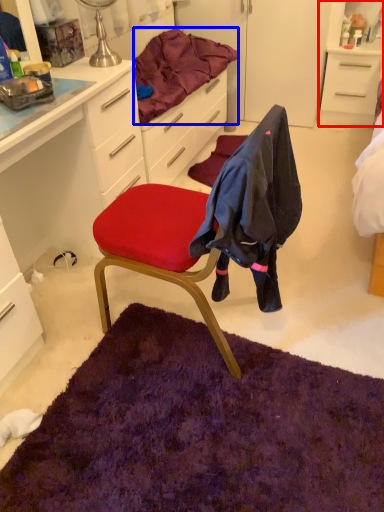
Question: Which object appears closest to the camera in this image, cabinetry (highlighted by a red box) or bedding (highlighted by a blue box)?

Choices:
 (A) cabinetry
 (B) bedding

Answer: (B)